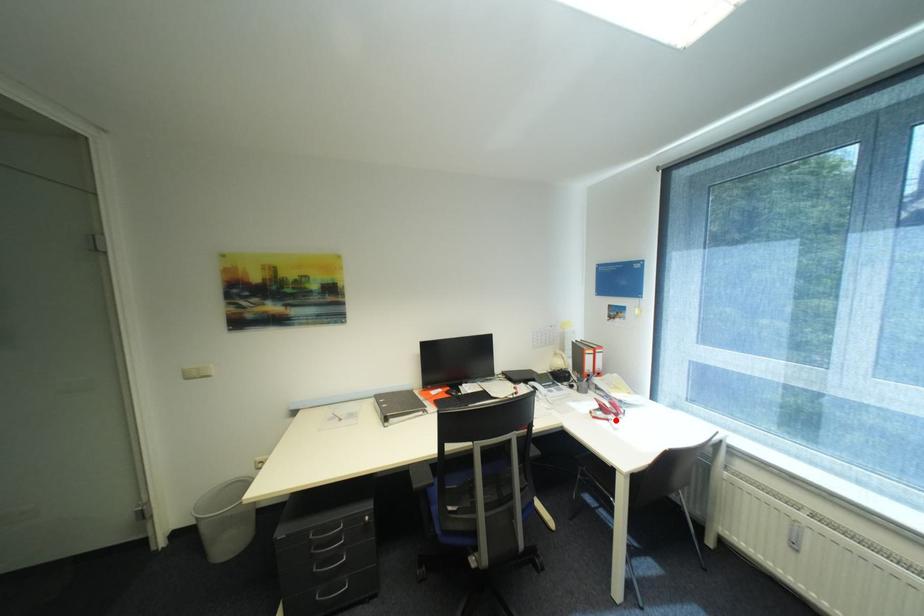
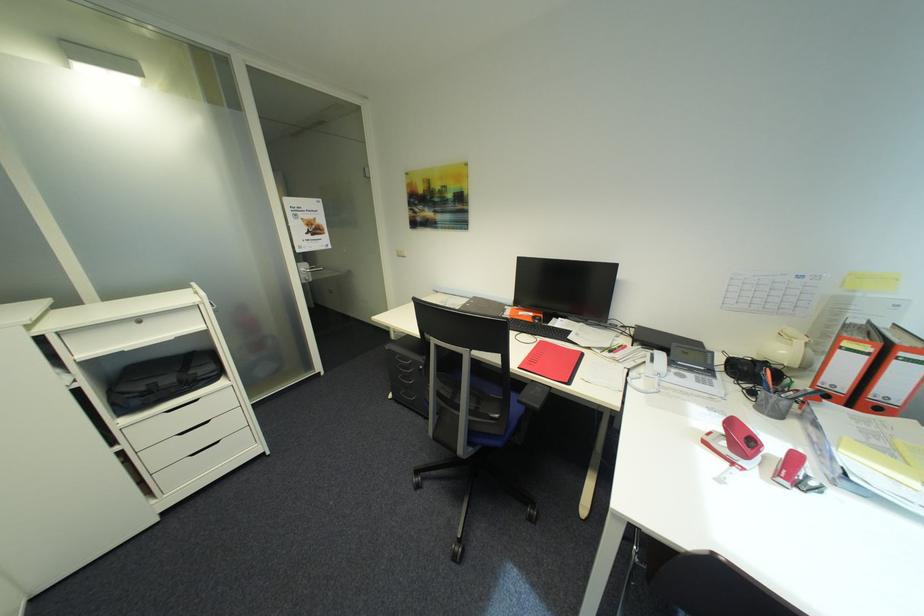
Where in the second image is the point corresponding to the highlighted location from the first image?

(742, 464)